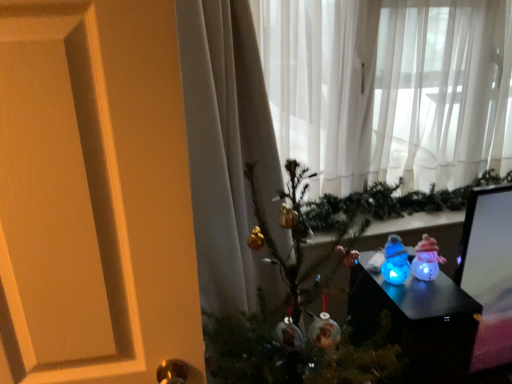
This screenshot has width=512, height=384. What do you see at coordinates (417, 322) in the screenshot? I see `translucent plastic snowmen at lower right` at bounding box center [417, 322].

Describe the element at coordinates (389, 88) in the screenshot. I see `sheer white curtain at upper center` at that location.

This screenshot has height=384, width=512. I want to click on metallic gold ornaments at center, so click(x=295, y=313).

In order to face blue translucent snowman at center, which is counted as the 2th toy, starting from the right, should I rotate leftwards or rightwards?

To face it directly, rotate right by 18.195 degrees.

At what (x,y) coordinates should I click in order to perform the action: click on translucent plastic snowmen at lower right. Please return your answer as a coordinate pair (x, y). Looking at the image, I should click on (417, 322).

Between point (381, 276) and point (310, 367), which one is positioned behind?

Point (381, 276)

How much distance is there between translucent plastic snowmen at lower right and metallic gold ornaments at center?

They are 6.34 inches apart.

Is translucent plastic snowmen at lower right not near metallic gold ornaments at center?

They are positioned close to each other.

Identify the location of toy above the translucent plastic snowman at center-right, marked as the 1th toy in a right-to-left arrangement (from the image's perspective). This screenshot has width=512, height=384. (395, 261).

Is blue translucent snowman at center, the first toy from the left, positioned with its back to translucent plastic snowman at center-right, the 2th toy viewed from the left?

That's not correct — blue translucent snowman at center, the first toy from the left, is not looking away from translucent plastic snowman at center-right, the 2th toy viewed from the left.

Can you tell me how much sheer white curtain at upper center and metallic gold ornaments at center differ in facing direction?

0.242 degrees separate the facing orientations of sheer white curtain at upper center and metallic gold ornaments at center.

Would you consider sheer white curtain at upper center to be distant from metallic gold ornaments at center?

No, sheer white curtain at upper center is in close proximity to metallic gold ornaments at center.

In terms of width, does sheer white curtain at upper center look wider or thinner when compared to metallic gold ornaments at center?

In the image, sheer white curtain at upper center appears to be more narrow than metallic gold ornaments at center.

Which point is more distant from viewer, (x=373, y=304) or (x=312, y=147)?

Point (x=312, y=147)

From a real-world perspective, which object stands above the other?

sheer white curtain at upper center.

This screenshot has width=512, height=384. What are the coordinates of `furniture that appears in front of the sheer white curtain at upper center` in the screenshot? It's located at 417,322.

How far apart are metallic gold ornaments at center and blue translucent snowman at center, the first toy from the left?

11.74 inches.

In the scene shown: Which of these two, metallic gold ornaments at center or blue translucent snowman at center, which is counted as the 2th toy, starting from the right, stands shorter?

blue translucent snowman at center, which is counted as the 2th toy, starting from the right, is shorter.

Choose the correct answer: Is metallic gold ornaments at center inside blue translucent snowman at center, which is counted as the 2th toy, starting from the right, or outside it?

metallic gold ornaments at center is spatially situated outside blue translucent snowman at center, which is counted as the 2th toy, starting from the right.

From a real-world perspective, is metallic gold ornaments at center positioned above or below blue translucent snowman at center, which is counted as the 2th toy, starting from the right?

metallic gold ornaments at center is situated lower than blue translucent snowman at center, which is counted as the 2th toy, starting from the right, in the real world.

Is translucent plastic snowman at center-right, marked as the 1th toy in a right-to-left arrangement, thinner than sheer white curtain at upper center?

Yes, translucent plastic snowman at center-right, marked as the 1th toy in a right-to-left arrangement, is thinner than sheer white curtain at upper center.

Is translucent plastic snowman at center-right, the 2th toy viewed from the left, not near sheer white curtain at upper center?

No.

Is translucent plastic snowman at center-right, the 2th toy viewed from the left, shorter than sheer white curtain at upper center?

Correct, translucent plastic snowman at center-right, the 2th toy viewed from the left, is not as tall as sheer white curtain at upper center.

Could you tell me if translucent plastic snowman at center-right, marked as the 1th toy in a right-to-left arrangement, is turned towards sheer white curtain at upper center?

No, translucent plastic snowman at center-right, marked as the 1th toy in a right-to-left arrangement, is not aimed at sheer white curtain at upper center.

Between metallic gold ornaments at center and sheer white curtain at upper center, which one has less height?

Standing shorter between the two is sheer white curtain at upper center.

From a real-world perspective, is metallic gold ornaments at center above or below sheer white curtain at upper center?

Clearly, from a real-world perspective, metallic gold ornaments at center is below sheer white curtain at upper center.

Considering the relative positions of metallic gold ornaments at center and sheer white curtain at upper center in the image provided, is metallic gold ornaments at center to the left of sheer white curtain at upper center from the viewer's perspective?

Correct, you'll find metallic gold ornaments at center to the left of sheer white curtain at upper center.

Between metallic gold ornaments at center and sheer white curtain at upper center, which one has smaller width?

sheer white curtain at upper center is thinner.

Find the location of `christmas tree above the translucent plastic snowmen at lower right (from a real-world perspective)`. christmas tree above the translucent plastic snowmen at lower right (from a real-world perspective) is located at coordinates (295, 313).

You are a GUI agent. You are given a task and a screenshot of the screen. Output one action in this format:
    pyautogui.click(x=<x>, y=<y>)
    Task: Click on the toy behind the blue translucent snowman at center, the first toy from the left
    The image size is (512, 384).
    Given the screenshot: What is the action you would take?
    pyautogui.click(x=426, y=259)

Estimate the real-world distances between objects in this image. Which object is further from sheer white curtain at upper center, blue translucent snowman at center, which is counted as the 2th toy, starting from the right, or metallic gold ornaments at center?

blue translucent snowman at center, which is counted as the 2th toy, starting from the right, is positioned further to the anchor sheer white curtain at upper center.

Estimate the real-world distances between objects in this image. Which object is closer to translucent plastic snowman at center-right, the 2th toy viewed from the left, translucent plastic snowmen at lower right or metallic gold ornaments at center?

The object closer to translucent plastic snowman at center-right, the 2th toy viewed from the left, is translucent plastic snowmen at lower right.

Looking at the image, which one is located further to blue translucent snowman at center, the first toy from the left, translucent plastic snowmen at lower right or translucent plastic snowman at center-right, marked as the 1th toy in a right-to-left arrangement?

Among the two, translucent plastic snowmen at lower right is located further to blue translucent snowman at center, the first toy from the left.

When comparing their distances from translucent plastic snowman at center-right, marked as the 1th toy in a right-to-left arrangement, does translucent plastic snowmen at lower right or blue translucent snowman at center, which is counted as the 2th toy, starting from the right, seem closer?

Among the two, blue translucent snowman at center, which is counted as the 2th toy, starting from the right, is located nearer to translucent plastic snowman at center-right, marked as the 1th toy in a right-to-left arrangement.

Based on the photo, based on their spatial positions, is metallic gold ornaments at center or blue translucent snowman at center, the first toy from the left, closer to sheer white curtain at upper center?

metallic gold ornaments at center is positioned closer to the anchor sheer white curtain at upper center.

In the scene shown: When comparing their distances from blue translucent snowman at center, the first toy from the left, does sheer white curtain at upper center or metallic gold ornaments at center seem closer?

metallic gold ornaments at center lies closer to blue translucent snowman at center, the first toy from the left, than the other object.

Based on their spatial positions, is metallic gold ornaments at center or translucent plastic snowman at center-right, marked as the 1th toy in a right-to-left arrangement, closer to blue translucent snowman at center, the first toy from the left?

translucent plastic snowman at center-right, marked as the 1th toy in a right-to-left arrangement, is positioned closer to the anchor blue translucent snowman at center, the first toy from the left.

Based on their spatial positions, is metallic gold ornaments at center or sheer white curtain at upper center closer to translucent plastic snowmen at lower right?

Based on the image, metallic gold ornaments at center appears to be nearer to translucent plastic snowmen at lower right.

Image resolution: width=512 pixels, height=384 pixels. In order to click on christmas tree between sheer white curtain at upper center and translucent plastic snowmen at lower right in the vertical direction in this screenshot , I will do `click(295, 313)`.

The image size is (512, 384). What are the coordinates of `toy between blue translucent snowman at center, the first toy from the left, and translucent plastic snowmen at lower right, in the vertical direction` in the screenshot? It's located at [x=426, y=259].

At what (x,y) coordinates should I click in order to perform the action: click on toy between sheer white curtain at upper center and translucent plastic snowman at center-right, marked as the 1th toy in a right-to-left arrangement, vertically. Please return your answer as a coordinate pair (x, y). This screenshot has width=512, height=384. Looking at the image, I should click on (395, 261).

This screenshot has height=384, width=512. I want to click on furniture located between metallic gold ornaments at center and blue translucent snowman at center, the first toy from the left, in the depth direction, so click(417, 322).